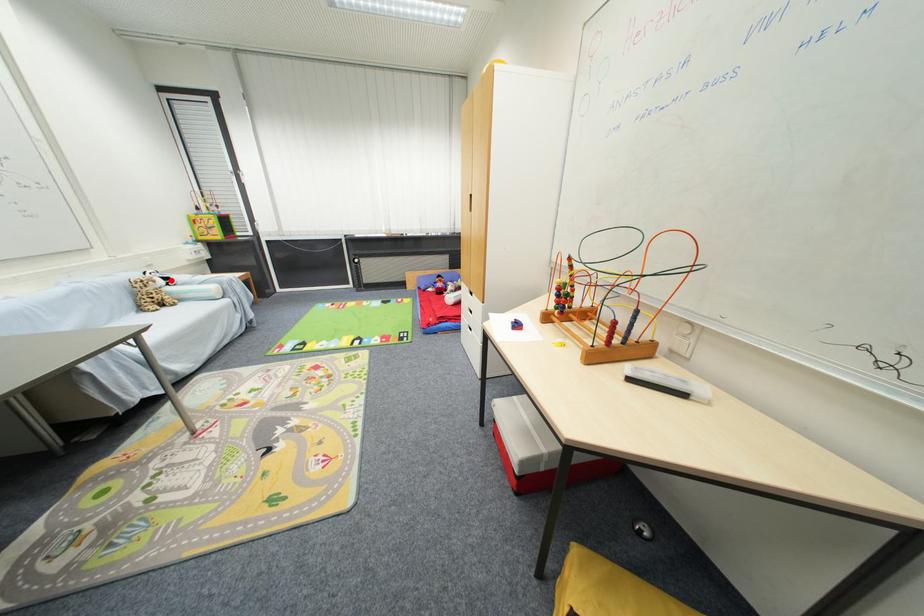
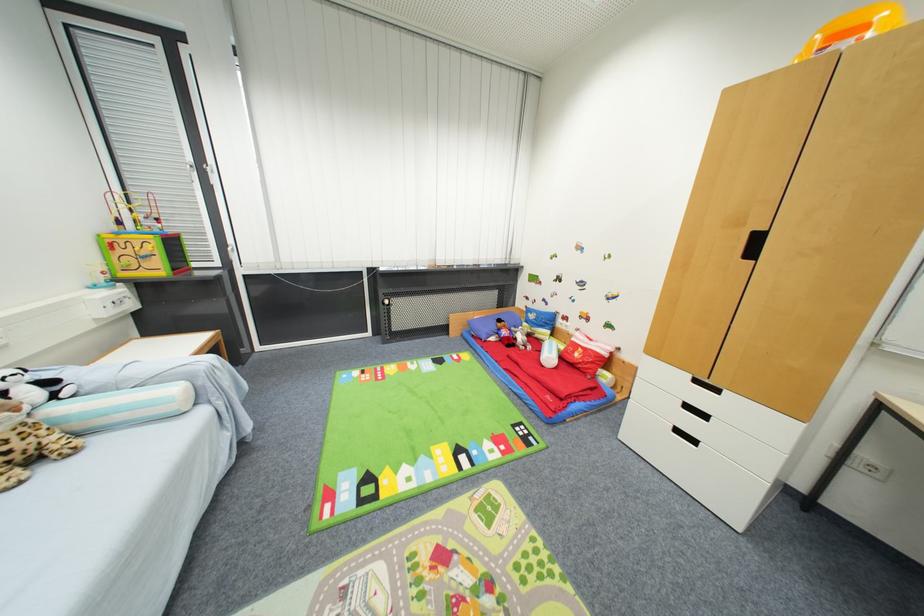
In the second image, find the point that corresponds to the highlighted location in the first image.

(54, 384)